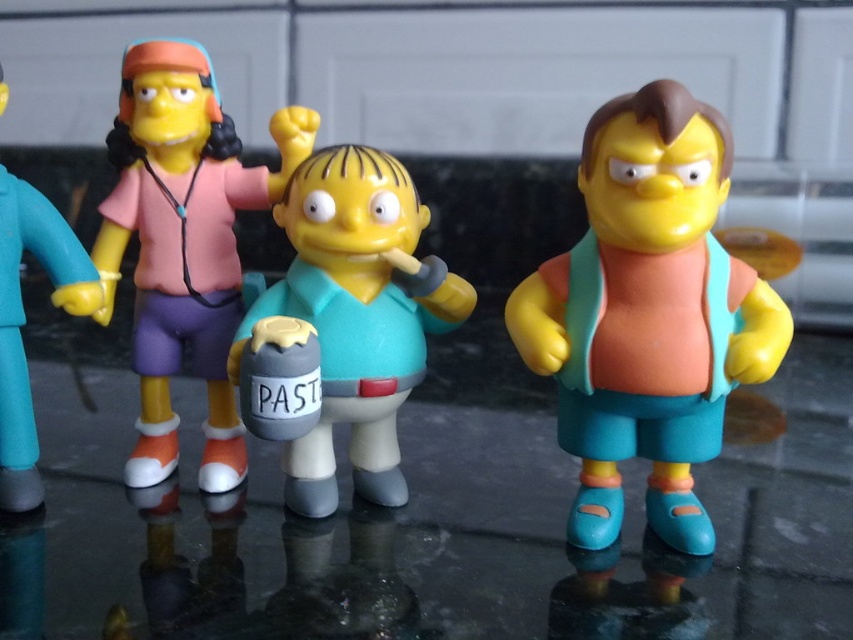
Between matte plastic figure at center and teal plastic figure at left, which one appears on the right side from the viewer's perspective?

matte plastic figure at center is more to the right.

This screenshot has height=640, width=853. What do you see at coordinates (183, 243) in the screenshot?
I see `matte plastic figure at center` at bounding box center [183, 243].

Identify the location of matte plastic figure at center. This screenshot has width=853, height=640. (183, 243).

Does matte orange shirt at center have a greater width compared to gray matte pastel at center?

Correct, the width of matte orange shirt at center exceeds that of gray matte pastel at center.

Who is higher up, matte orange shirt at center or gray matte pastel at center?

matte orange shirt at center is higher up.

Is point (634, 387) farther from viewer compared to point (265, 404)?

Yes, it is behind point (265, 404).

The height and width of the screenshot is (640, 853). In order to click on matte orange shirt at center in this screenshot , I will do `click(647, 314)`.

Does matte orange shirt at center appear over teal plastic figure at left?

Incorrect, matte orange shirt at center is not positioned above teal plastic figure at left.

Does point (650, 280) lie in front of point (19, 339)?

Yes.

In order to click on matte orange shirt at center in this screenshot , I will do `click(647, 314)`.